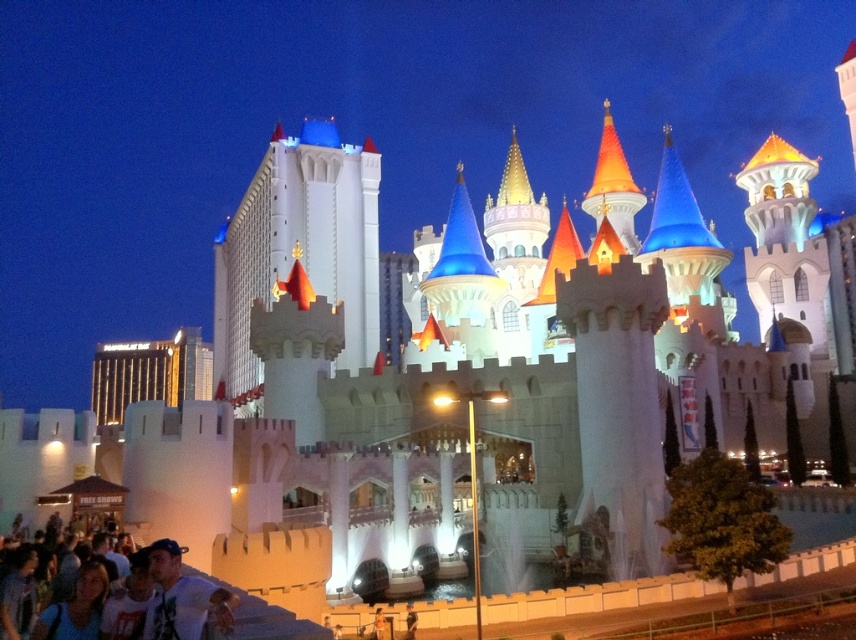
Is orange-tinted stone tower at upper right to the left of white t-shirt at lower left from the viewer's perspective?

No, orange-tinted stone tower at upper right is not to the left of white t-shirt at lower left.

From the picture: Between orange-tinted stone tower at upper right and white t-shirt at lower left, which one appears on the left side from the viewer's perspective?

Positioned to the left is white t-shirt at lower left.

Locate an element on the screen. orange-tinted stone tower at upper right is located at coordinates 783,241.

The image size is (856, 640). What do you see at coordinates (300, 244) in the screenshot? I see `white stone castle at center` at bounding box center [300, 244].

Can you confirm if white stone castle at center is smaller than orange-tinted stone tower at upper right?

Actually, white stone castle at center might be larger than orange-tinted stone tower at upper right.

Is point (272, 224) positioned after point (749, 269)?

Yes, point (272, 224) is behind point (749, 269).

At what (x,y) coordinates should I click in order to perform the action: click on white stone castle at center. Please return your answer as a coordinate pair (x, y). The width and height of the screenshot is (856, 640). Looking at the image, I should click on (300, 244).

Which is behind, point (51, 621) or point (90, 620)?

Positioned behind is point (90, 620).

Does point (163, 564) come behind point (79, 628)?

Yes, point (163, 564) is behind point (79, 628).

Measure the distance between white t-shirt at lower left and camera.

white t-shirt at lower left and camera are 33.09 meters apart.

Where is `white t-shirt at lower left`? The image size is (856, 640). white t-shirt at lower left is located at coordinates (175, 593).